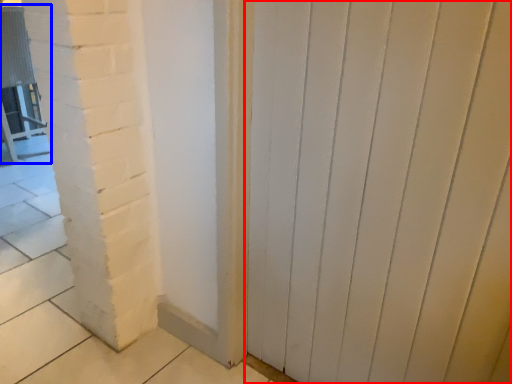
Question: Among these objects, which one is nearest to the camera, door (highlighted by a red box) or chair (highlighted by a blue box)?

Choices:
 (A) door
 (B) chair

Answer: (A)